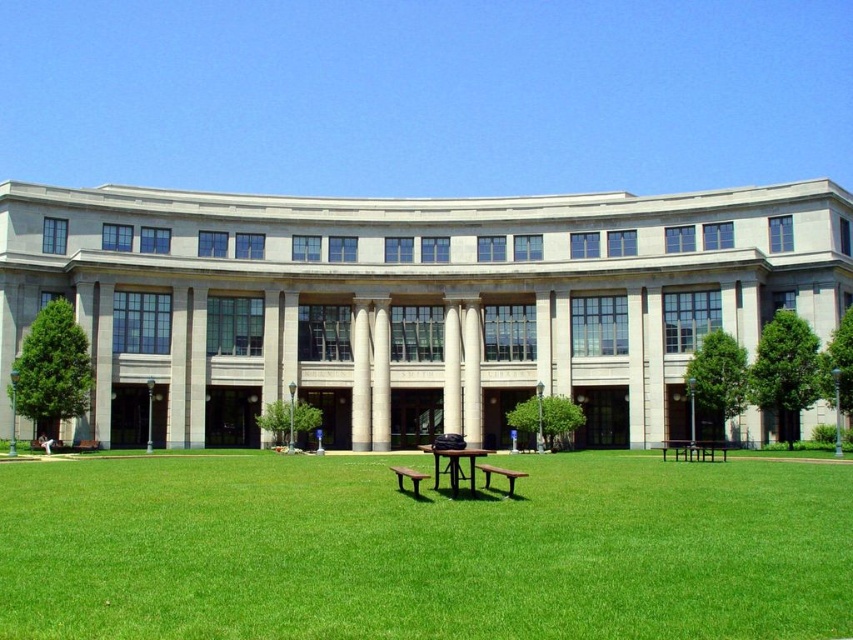
Question: Can you confirm if brown wooden picnic table at center is positioned to the left of brown wooden park bench at lower right?

Choices:
 (A) yes
 (B) no

Answer: (A)

Question: In this image, where is brown wooden park bench at lower right located relative to brown wooden park bench at center?

Choices:
 (A) below
 (B) above

Answer: (B)

Question: Which point is closer to the camera?

Choices:
 (A) (511, 474)
 (B) (399, 474)
 (C) (421, 448)
 (D) (723, 460)

Answer: (A)

Question: Can you confirm if brown wooden park bench at center is positioned to the left of brown wooden bench at center?

Choices:
 (A) yes
 (B) no

Answer: (B)

Question: Which point appears closest to the camera in this image?

Choices:
 (A) (714, 460)
 (B) (402, 490)
 (C) (662, 444)
 (D) (486, 477)

Answer: (D)

Question: Estimate the real-world distances between objects in this image. Which object is closer to the brown wooden bench at center?

Choices:
 (A) brown wooden park bench at lower right
 (B) brown wooden park bench at center
 (C) brown wooden park bench at lower center

Answer: (C)